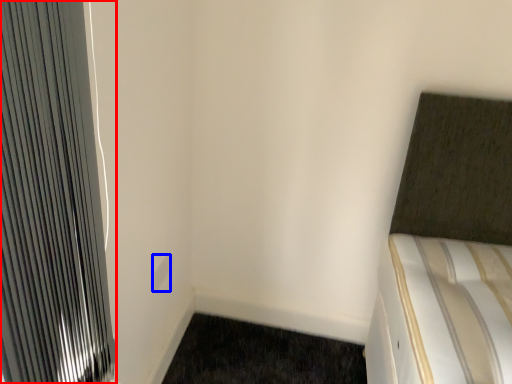
Question: Which of the following is the closest to the observer, radiator (highlighted by a red box) or electric outlet (highlighted by a blue box)?

Choices:
 (A) radiator
 (B) electric outlet

Answer: (A)